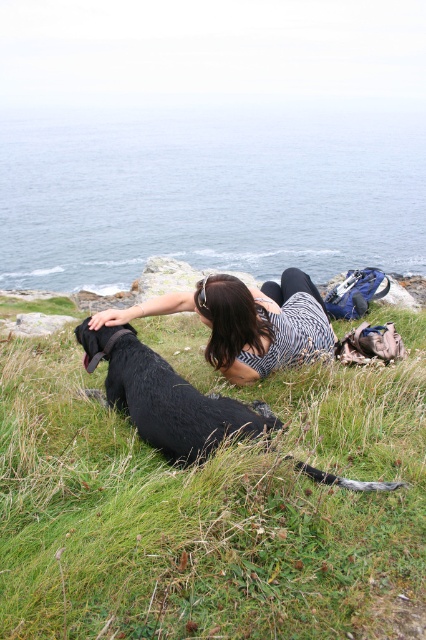
Question: In this image, where is green grassy at center located relative to shiny black dog at center?

Choices:
 (A) above
 (B) below

Answer: (B)

Question: Which point appears closest to the camera in this image?

Choices:
 (A) (302, 310)
 (B) (123, 387)

Answer: (B)

Question: Among these objects, which one is nearest to the camera?

Choices:
 (A) striped fabric shirt at center
 (B) shiny black dog at center
 (C) green grassy at center

Answer: (C)

Question: Is green grassy at center bigger than shiny black dog at center?

Choices:
 (A) yes
 (B) no

Answer: (A)

Question: Is shiny black dog at center closer to camera compared to striped fabric shirt at center?

Choices:
 (A) yes
 (B) no

Answer: (A)

Question: Which object appears farthest from the camera in this image?

Choices:
 (A) shiny black dog at center
 (B) striped fabric shirt at center
 (C) green grassy at center

Answer: (B)